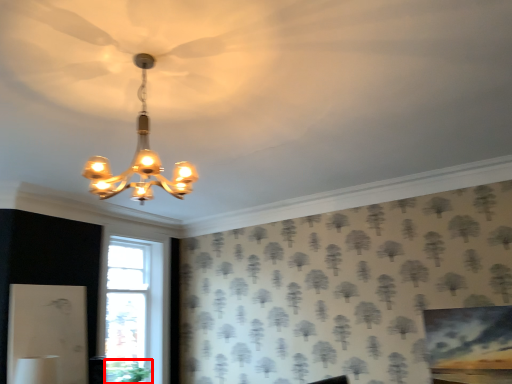
Question: From the image, what is the correct spatial relationship of plant (annotated by the red box) in relation to lamp?

Choices:
 (A) right
 (B) left

Answer: (B)